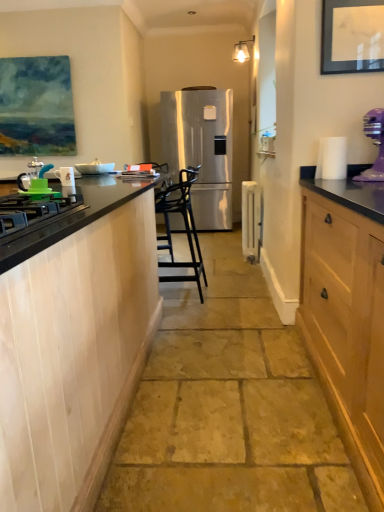
At what (x,y) coordinates should I click in order to perform the action: click on free region under white metallic radiator at center, placed as the 4th appliance when sorted from front to back (from a real-world perspective). Please return your answer as a coordinate pair (x, y). Looking at the image, I should click on [247, 258].